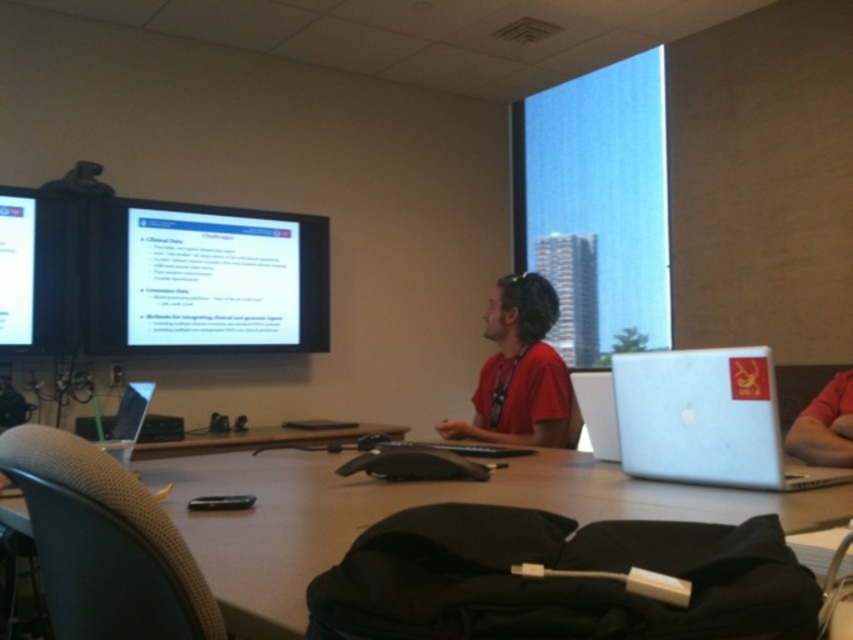
Does point (296, 616) come in front of point (57, 346)?

Yes, point (296, 616) is in front of point (57, 346).

Based on the photo, is smooth wooden table at center shorter than matte black monitor at left?

Correct, smooth wooden table at center is not as tall as matte black monitor at left.

The width and height of the screenshot is (853, 640). I want to click on smooth wooden table at center, so click(408, 506).

Which of these two, silver metallic laptop at right or red matte shirt at right, stands taller?

silver metallic laptop at right

Can you confirm if silver metallic laptop at right is smaller than red matte shirt at right?

Actually, silver metallic laptop at right might be larger than red matte shirt at right.

You are a GUI agent. You are given a task and a screenshot of the screen. Output one action in this format:
    pyautogui.click(x=<x>, y=<y>)
    Task: Click on the silver metallic laptop at right
    This screenshot has height=640, width=853.
    Given the screenshot: What is the action you would take?
    pyautogui.click(x=705, y=419)

Where is `silver metallic laptop at right`? This screenshot has width=853, height=640. silver metallic laptop at right is located at coordinates (705, 419).

Does matte black screen at upper left have a larger size compared to silver metallic laptop at right?

Indeed, matte black screen at upper left has a larger size compared to silver metallic laptop at right.

Which is behind, point (195, 204) or point (683, 412)?

Point (195, 204)

Find the location of a particular element. The width and height of the screenshot is (853, 640). matte black screen at upper left is located at coordinates (204, 278).

At what (x,y) coordinates should I click in order to perform the action: click on matte black screen at upper left. Please return your answer as a coordinate pair (x, y). Looking at the image, I should click on tap(204, 278).